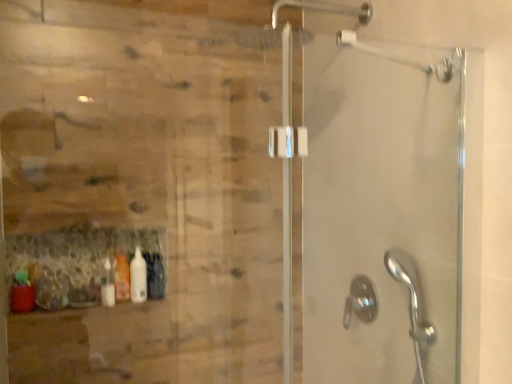
Question: Is matte red bottle at lower left, the first bottle in the left-to-right sequence, shorter than translucent plastic bottle at lower left, the third bottle in the front-to-back sequence?

Choices:
 (A) yes
 (B) no

Answer: (A)

Question: Is matte red bottle at lower left, the third bottle viewed from the right, located outside translucent plastic bottle at lower left, the third bottle in the front-to-back sequence?

Choices:
 (A) yes
 (B) no

Answer: (A)

Question: Can you confirm if matte red bottle at lower left, the third bottle viewed from the right, is positioned to the right of translucent plastic bottle at lower left, the second bottle when ordered from left to right?

Choices:
 (A) no
 (B) yes

Answer: (A)

Question: Is matte red bottle at lower left, the third bottle viewed from the right, facing towards translucent plastic bottle at lower left, which appears as the first bottle when viewed from the back?

Choices:
 (A) no
 (B) yes

Answer: (A)

Question: Is matte red bottle at lower left, the third bottle viewed from the right, to the left of translucent plastic bottle at lower left, which appears as the first bottle when viewed from the back, from the viewer's perspective?

Choices:
 (A) yes
 (B) no

Answer: (A)

Question: In terms of size, does white glossy bottle at lower left, which is the third bottle from left to right, appear bigger or smaller than matte red bottle at lower left, the first bottle from the front?

Choices:
 (A) big
 (B) small

Answer: (B)

Question: From a real-world perspective, relative to matte red bottle at lower left, acting as the 3th bottle starting from the back, is white glossy bottle at lower left, marked as the 1th bottle in a right-to-left arrangement, vertically above or below?

Choices:
 (A) below
 (B) above

Answer: (B)

Question: Considering the positions of white glossy bottle at lower left, which is the third bottle from left to right, and matte red bottle at lower left, the first bottle in the left-to-right sequence, in the image, is white glossy bottle at lower left, which is the third bottle from left to right, taller or shorter than matte red bottle at lower left, the first bottle in the left-to-right sequence,?

Choices:
 (A) tall
 (B) short

Answer: (A)

Question: Considering their positions, is white glossy bottle at lower left, the second bottle positioned from the back, located in front of or behind matte red bottle at lower left, the first bottle in the left-to-right sequence?

Choices:
 (A) behind
 (B) front

Answer: (A)

Question: Looking at their shapes, would you say white glossy bottle at lower left, the second bottle positioned from the back, is wider or thinner than translucent plastic bottle at lower left, which ranks as the 2th bottle in right-to-left order?

Choices:
 (A) thin
 (B) wide

Answer: (B)

Question: Considering the positions of point (142, 284) and point (128, 279), is point (142, 284) closer or farther from the camera than point (128, 279)?

Choices:
 (A) closer
 (B) farther

Answer: (A)

Question: Looking at the image, does white glossy bottle at lower left, the 2th bottle positioned from the front, seem bigger or smaller compared to translucent plastic bottle at lower left, which ranks as the 2th bottle in right-to-left order?

Choices:
 (A) big
 (B) small

Answer: (A)

Question: From the image's perspective, is white glossy bottle at lower left, the second bottle positioned from the back, above or below translucent plastic bottle at lower left, the third bottle in the front-to-back sequence?

Choices:
 (A) above
 (B) below

Answer: (A)

Question: From a real-world perspective, is translucent plastic bottle at lower left, the third bottle in the front-to-back sequence, above or below satin nickel showerhead at lower right?

Choices:
 (A) below
 (B) above

Answer: (B)

Question: In terms of width, does translucent plastic bottle at lower left, the third bottle in the front-to-back sequence, look wider or thinner when compared to satin nickel showerhead at lower right?

Choices:
 (A) wide
 (B) thin

Answer: (B)